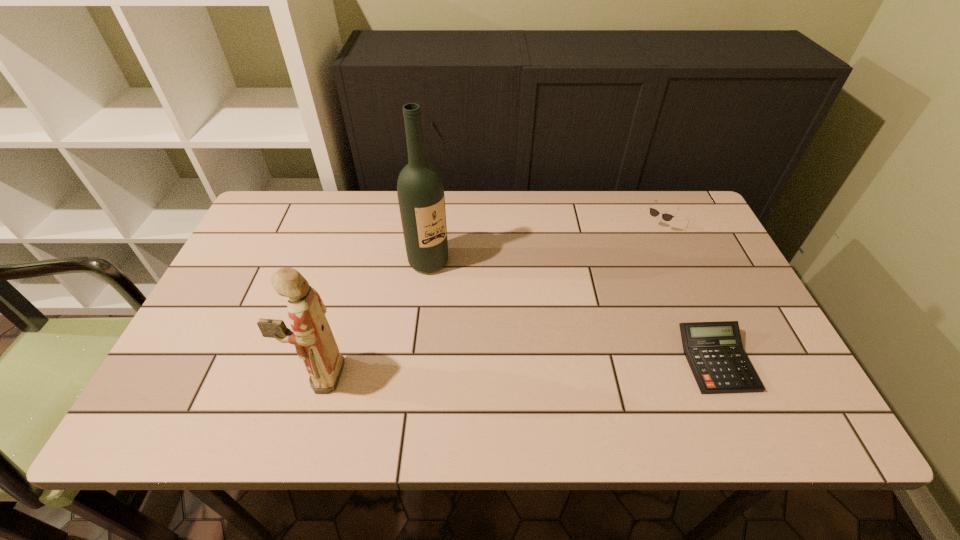
Locate which object is the closest to the second tallest object. Please provide its 2D coordinates. Your answer should be formatted as a tuple, i.e. [(x, y)], where the tuple contains the x and y coordinates of a point satisfying the conditions above.

[(420, 190)]

Select which object is the second closest to the shortest object. Please provide its 2D coordinates. Your answer should be formatted as a tuple, i.e. [(x, y)], where the tuple contains the x and y coordinates of a point satisfying the conditions above.

[(420, 190)]